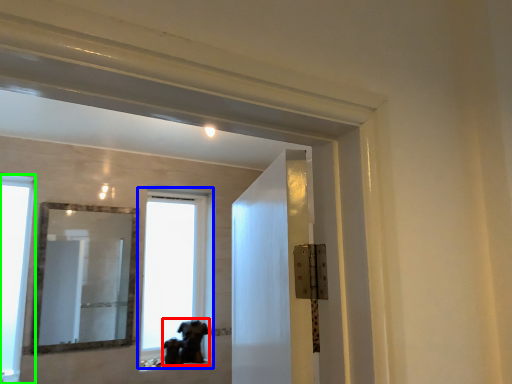
Question: Which object is positioned closest to animal (highlighted by a red box)? Select from window (highlighted by a blue box) and window (highlighted by a green box).

Choices:
 (A) window
 (B) window

Answer: (B)